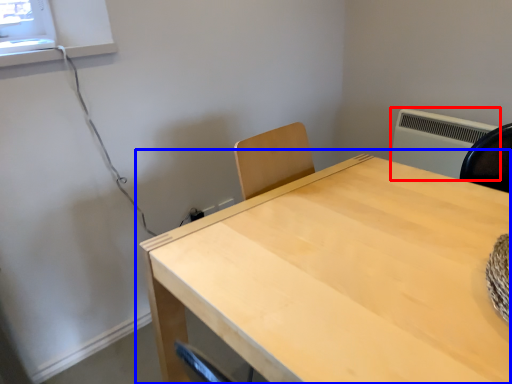
Question: Which object is further to the camera taking this photo, air conditioning (highlighted by a red box) or table (highlighted by a blue box)?

Choices:
 (A) air conditioning
 (B) table

Answer: (A)